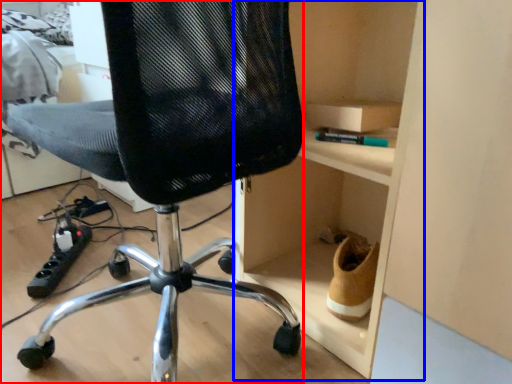
Question: Which object is further to the camera taking this photo, chair (highlighted by a red box) or cabinet (highlighted by a blue box)?

Choices:
 (A) chair
 (B) cabinet

Answer: (B)